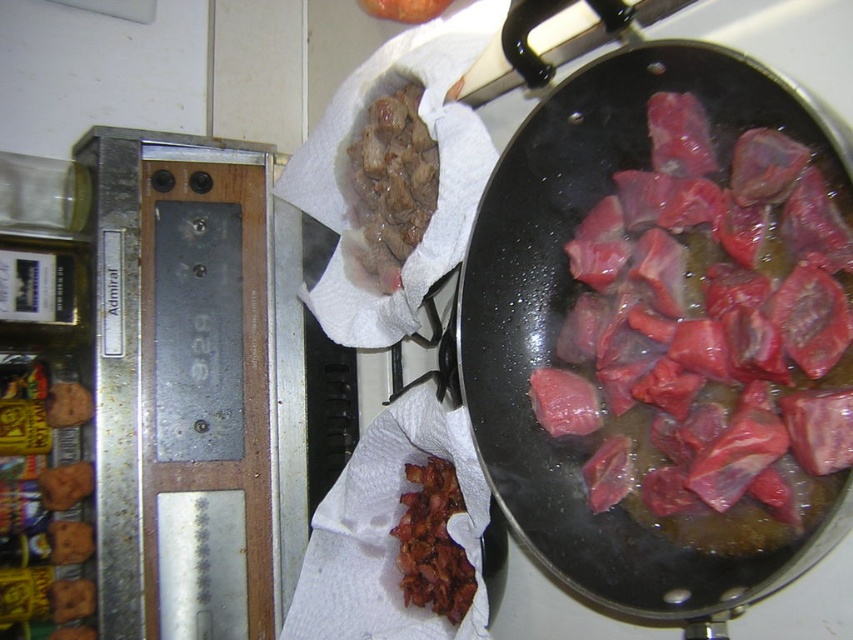
Question: Does shiny black wok at center appear over slightly crispy bacon at center?

Choices:
 (A) no
 (B) yes

Answer: (B)

Question: Does shiny black wok at center appear under slightly crispy bacon at center?

Choices:
 (A) no
 (B) yes

Answer: (A)

Question: Among these points, which one is nearest to the camera?

Choices:
 (A) (821, 28)
 (B) (413, 472)

Answer: (A)

Question: Considering the relative positions of shiny black wok at center and slightly crispy bacon at center in the image provided, where is shiny black wok at center located with respect to slightly crispy bacon at center?

Choices:
 (A) left
 (B) right

Answer: (B)